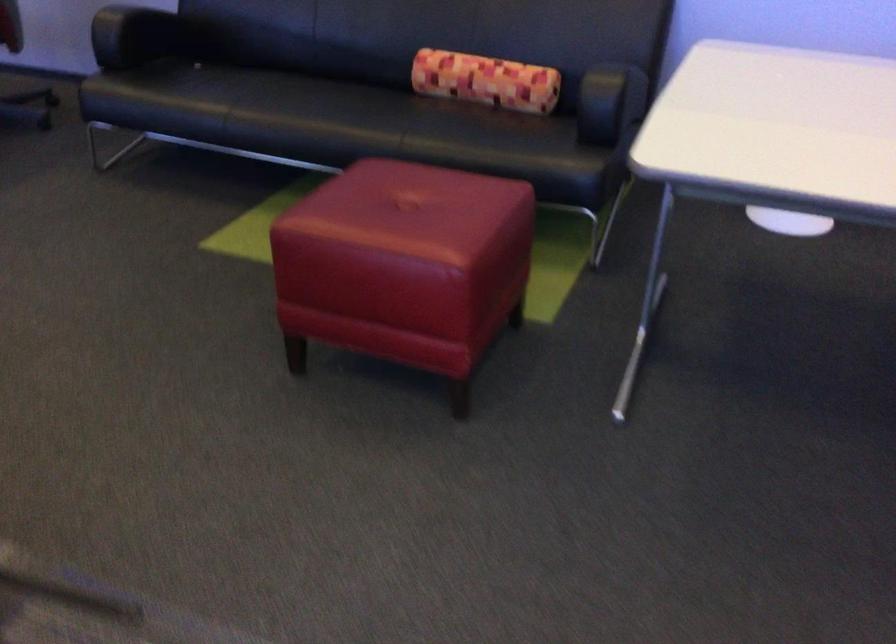
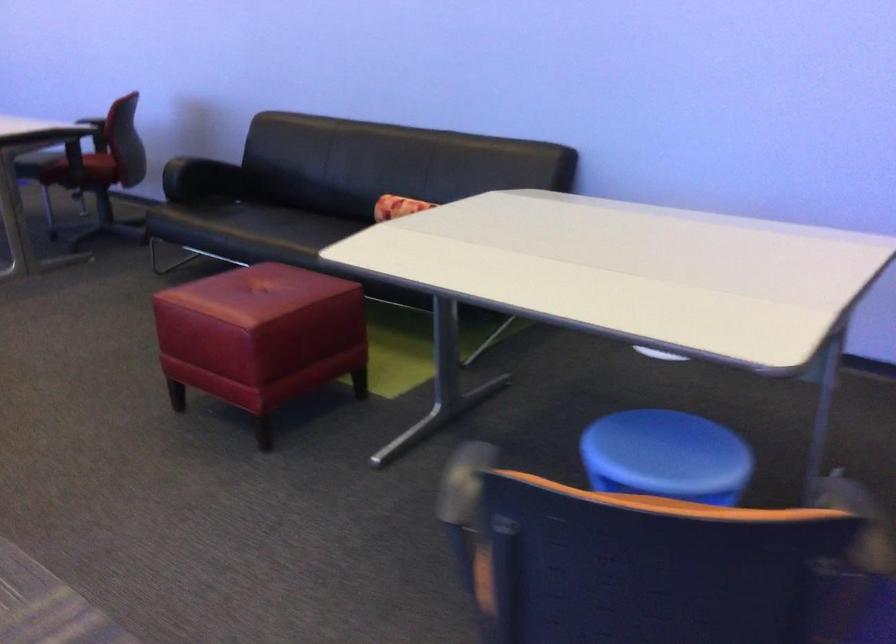
Locate, in the second image, the point that corresponds to [406,204] in the first image.

(260, 292)